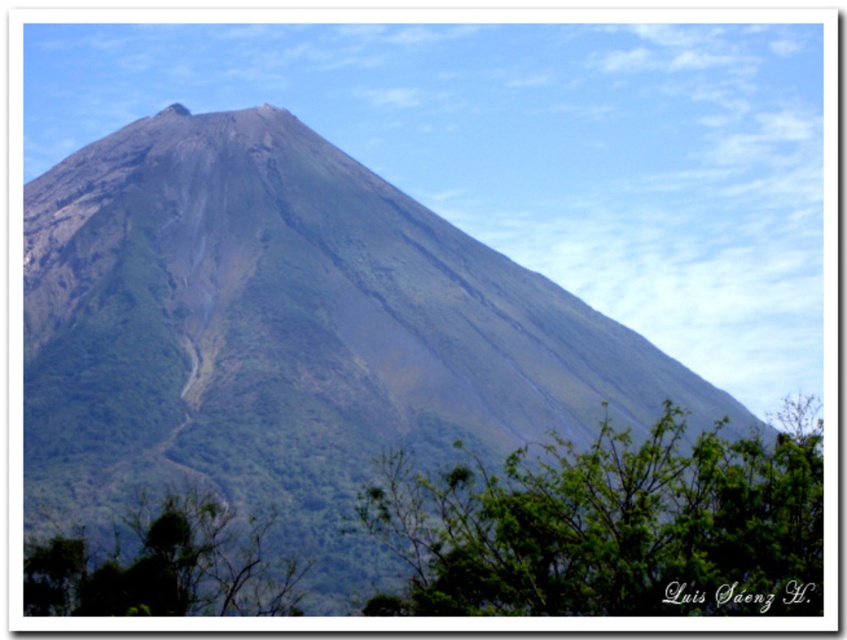
Question: Does green rock mountain at center come in front of green leafy tree at lower left?

Choices:
 (A) yes
 (B) no

Answer: (B)

Question: Considering the real-world distances, which object is closest to the green leafy tree at lower left?

Choices:
 (A) green leafy tree at lower center
 (B) green rock mountain at center

Answer: (A)

Question: Which object appears closest to the camera in this image?

Choices:
 (A) green leafy tree at lower center
 (B) green leafy tree at lower left

Answer: (A)

Question: Is green leafy tree at lower center closer to the viewer compared to green leafy tree at lower left?

Choices:
 (A) no
 (B) yes

Answer: (B)

Question: In this image, where is green rock mountain at center located relative to green leafy tree at lower center?

Choices:
 (A) above
 (B) below

Answer: (A)

Question: Which point is farther to the camera?

Choices:
 (A) green leafy tree at lower left
 (B) green leafy tree at lower center

Answer: (A)